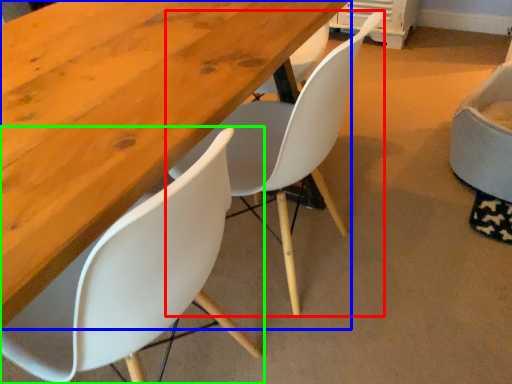
Question: Estimate the real-world distances between objects in this image. Which object is closer to chair (highlighted by a red box), table (highlighted by a blue box) or chair (highlighted by a green box)?

Choices:
 (A) table
 (B) chair

Answer: (A)